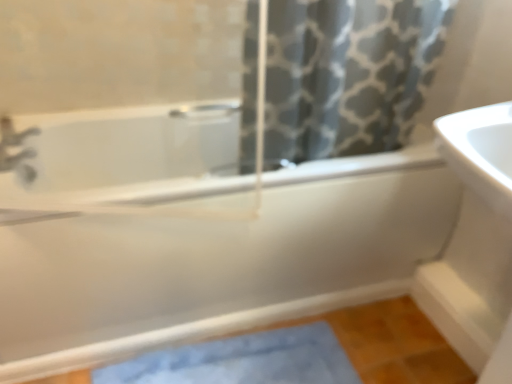
Question: Is gray printed fabric at upper center to the left or to the right of matte silver faucet at upper left in the image?

Choices:
 (A) left
 (B) right

Answer: (B)

Question: Does point (352, 92) appear closer or farther from the camera than point (0, 140)?

Choices:
 (A) closer
 (B) farther

Answer: (A)

Question: Which object is the farthest from the matte silver faucet at upper left?

Choices:
 (A) white glossy bathtub at center
 (B) white glossy sink at right
 (C) blue fabric bath mat at lower center
 (D) gray printed fabric at upper center

Answer: (B)

Question: Which of these objects is positioned farthest from the white glossy sink at right?

Choices:
 (A) white glossy bathtub at center
 (B) matte silver faucet at upper left
 (C) blue fabric bath mat at lower center
 (D) gray printed fabric at upper center

Answer: (B)